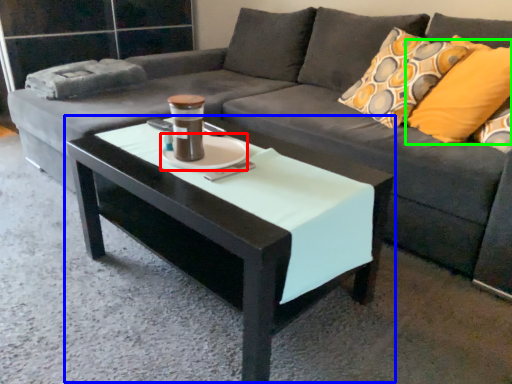
Question: Which object is positioned closest to saucer (highlighted by a red box)? Select from coffee table (highlighted by a blue box) and pillow (highlighted by a green box).

Choices:
 (A) coffee table
 (B) pillow

Answer: (A)